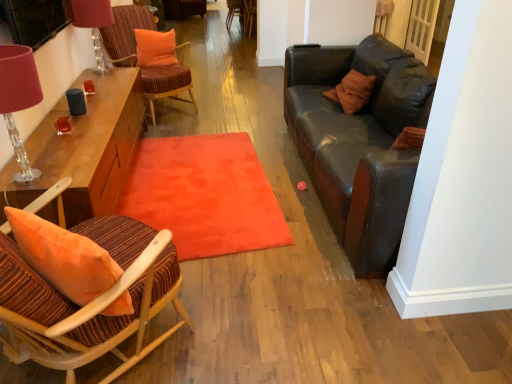
The image size is (512, 384). Identify the location of vacant space to the right of velvet orange chair at upper left, placed as the second chair when sorted from back to front. coord(222,115).